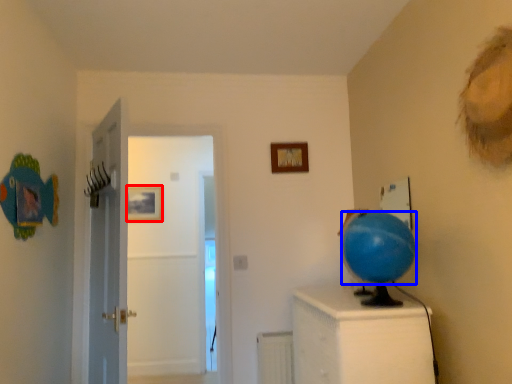
Question: Which object appears farthest to the camera in this image, picture frame (highlighted by a red box) or balloon (highlighted by a blue box)?

Choices:
 (A) picture frame
 (B) balloon

Answer: (A)